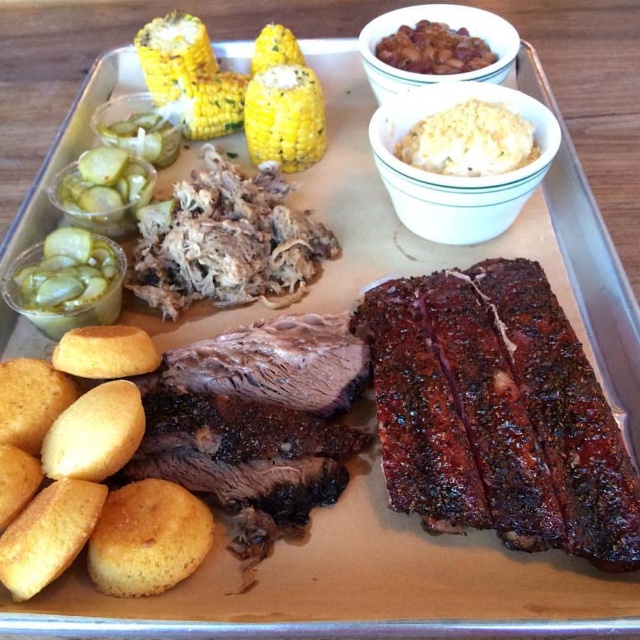
Question: Which object appears farthest from the camera in this image?

Choices:
 (A) yellow/corn at center
 (B) charred wood-grain ribs at right
 (C) white creamy mashed potatoes at center

Answer: (A)

Question: Which point is farther from the camera taking this photo?

Choices:
 (A) (492, 77)
 (B) (481, 65)
 (C) (276, 52)

Answer: (C)

Question: Estimate the real-world distances between objects in this image. Which object is farther from the yellow/corn at center?

Choices:
 (A) yellow/golden/corn at center
 (B) brown glossy beans at upper center
 (C) white creamy mashed potatoes at upper center
 (D) brown textured beans at upper center

Answer: (C)

Question: Where is yellowgrainy/crumblycorn at upper left located in relation to yellow/golden corn at upper left in the image?

Choices:
 (A) left
 (B) right

Answer: (A)

Question: Does charred wood-grain ribs at right appear on the left side of yellow/golden/corn at center?

Choices:
 (A) yes
 (B) no

Answer: (B)

Question: Is brown textured beans at upper center below brown glossy beans at upper center?

Choices:
 (A) no
 (B) yes

Answer: (B)